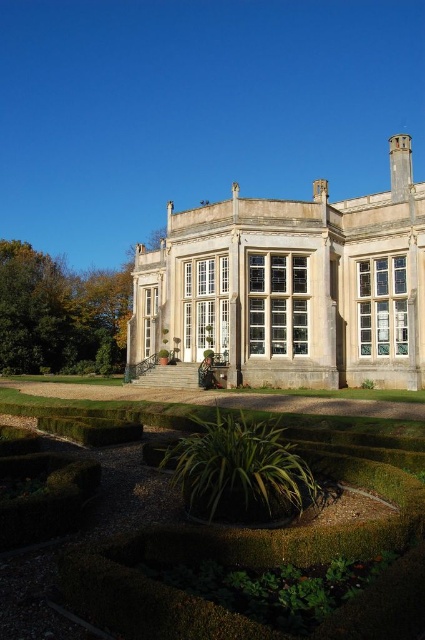
You are a gardener planning to trim the green leafy hedge at lower left and the green leafy hedge at lower center. Which hedge should you start with if you want to tackle the wider one first?

The green leafy hedge at lower left might be wider than the green leafy hedge at lower center, so you should start with the green leafy hedge at lower left.

You are standing in the garden in front of the white stone mansion at center. If you walk straight ahead, will you reach the mansion before the circular arrangement of plants?

The white stone mansion at center is located at point (291, 285) in the image. Since the circular arrangement of plants is part of the garden in front of the mansion, walking straight ahead from the garden would lead you towards the mansion first before encountering the plants.

You are standing in the garden of the grand classical building. You see a point marked at coordinates (291, 285). What does this point represent?

The point at coordinates (291, 285) represents the white stone mansion at center.